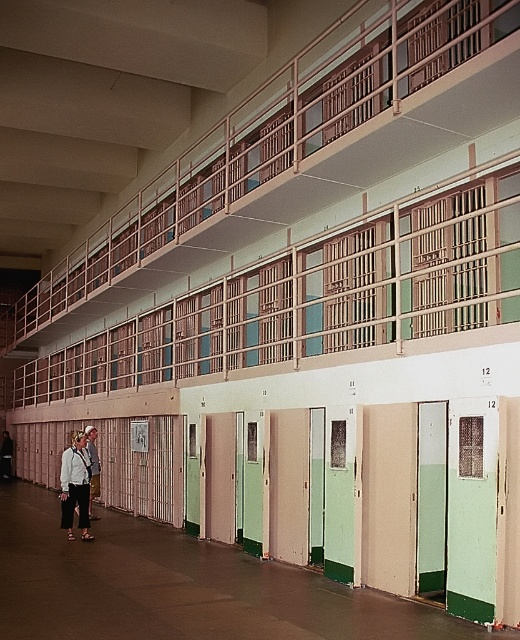
You are a guard in a prison facility and you see the white cotton shirt at lower left. Can you reach it within 10 meters without moving?

The white cotton shirt at lower left is 12.29 meters away from viewer, so no, you cannot reach it within 10 meters without moving.

You are a prison guard standing in the corridor. You notice two items at the lower left corner of the scene. Which item is closer to you between the white cotton shirt at lower left and the light brown leather jacket at lower left?

The white cotton shirt at lower left is closer to you since it is positioned in front of the light brown leather jacket at lower left.